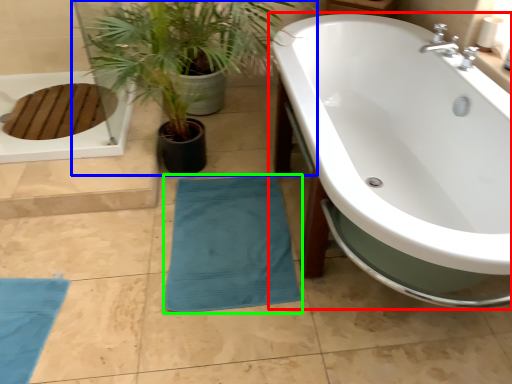
Question: Which is farther away from bathtub (highlighted by a red box)? houseplant (highlighted by a blue box) or beach towel (highlighted by a green box)?

Choices:
 (A) houseplant
 (B) beach towel

Answer: (A)